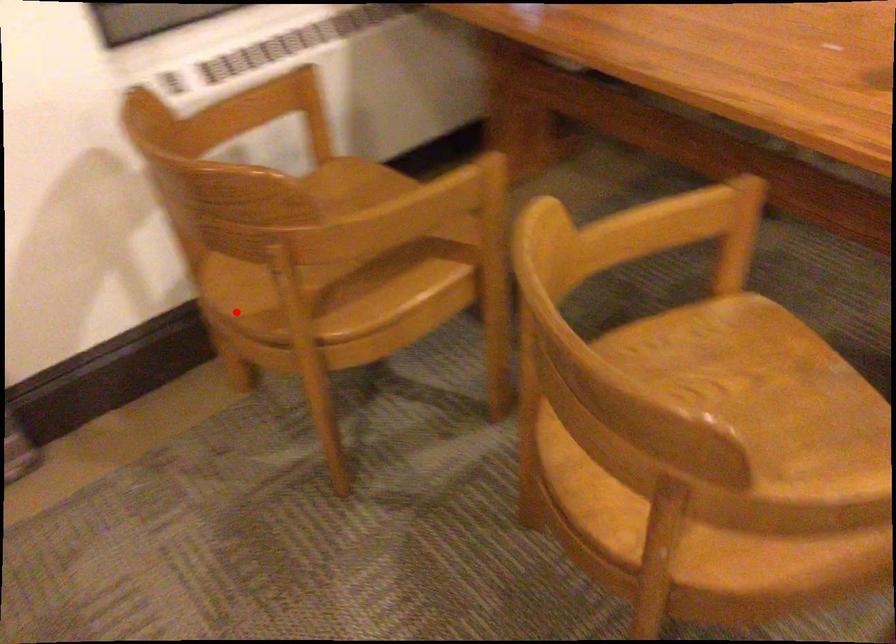
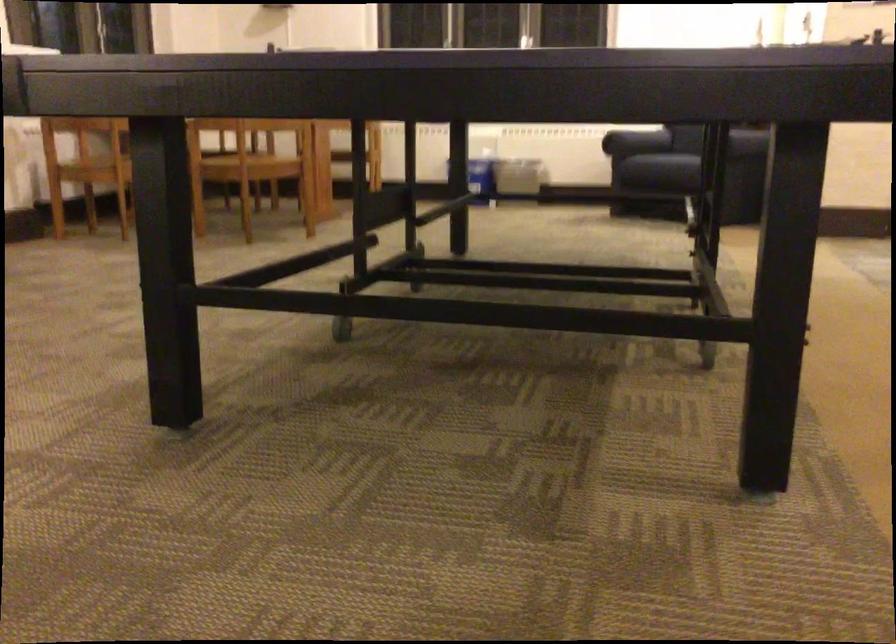
Question: I am providing you with two images of the same scene from different viewpoints. Image1 has a red point marked. In image2, the corresponding 3D location appears at what relative position? Reply with the corresponding letter.

Choices:
 (A) Closer
 (B) Farther

Answer: (B)